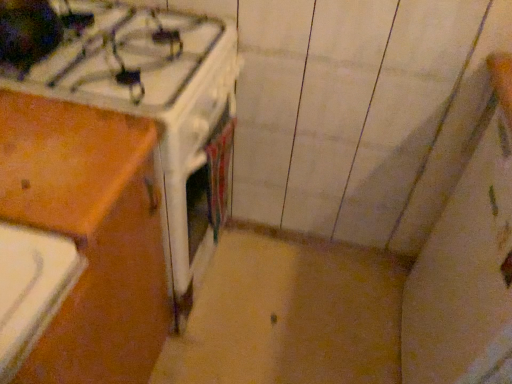
The height and width of the screenshot is (384, 512). In order to click on empty space that is ontop of wooden at left (from a real-world perspective) in this screenshot , I will do `click(46, 145)`.